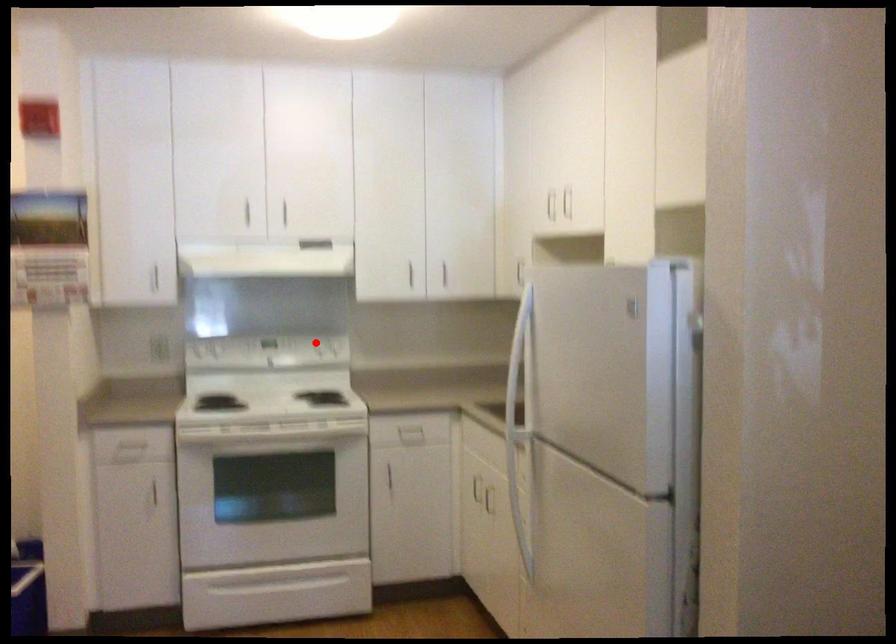
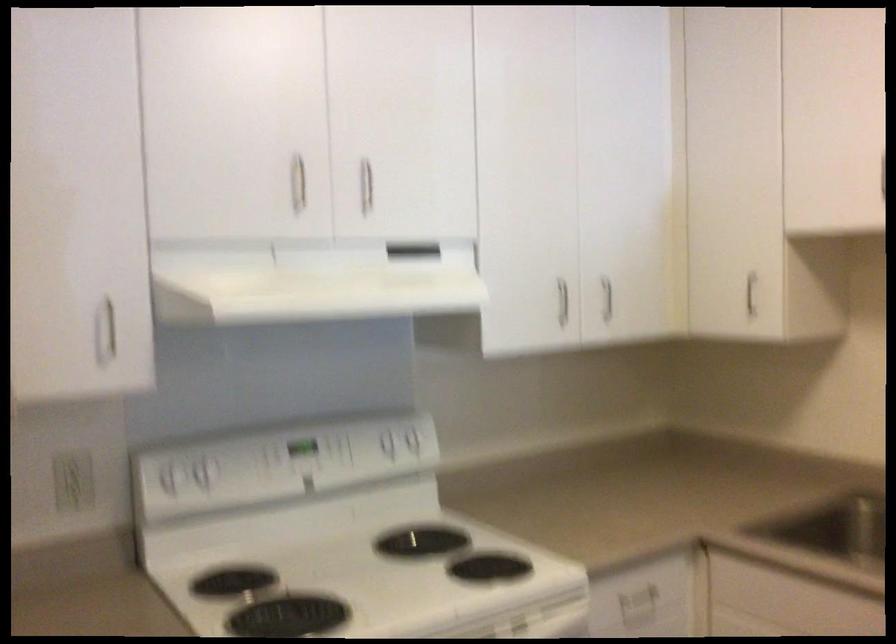
Question: I am providing you with two images of the same scene from different viewpoints. Given a red point in image1, look at the same physical point in image2. Is it:

Choices:
 (A) Closer to the viewpoint
 (B) Farther from the viewpoint

Answer: (A)